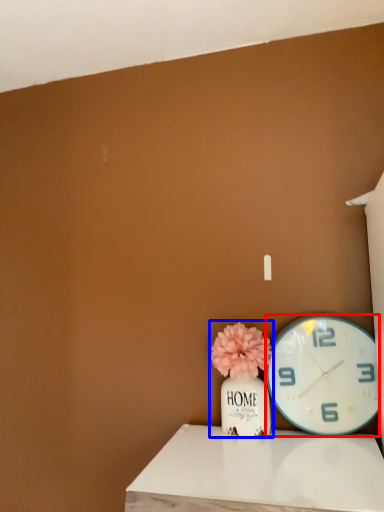
Question: Which object is closer to the camera taking this photo, wall clock (highlighted by a red box) or floral arrangement (highlighted by a blue box)?

Choices:
 (A) wall clock
 (B) floral arrangement

Answer: (A)